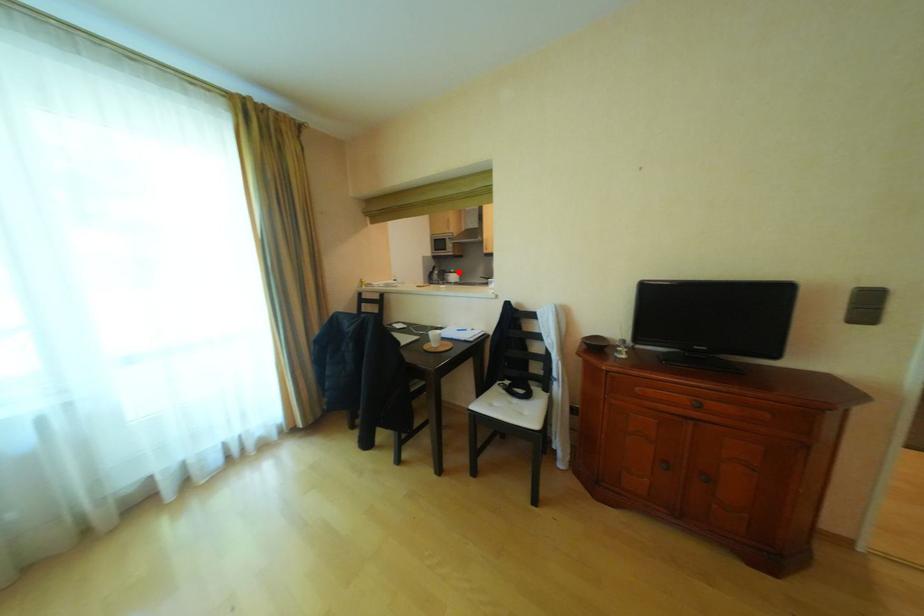
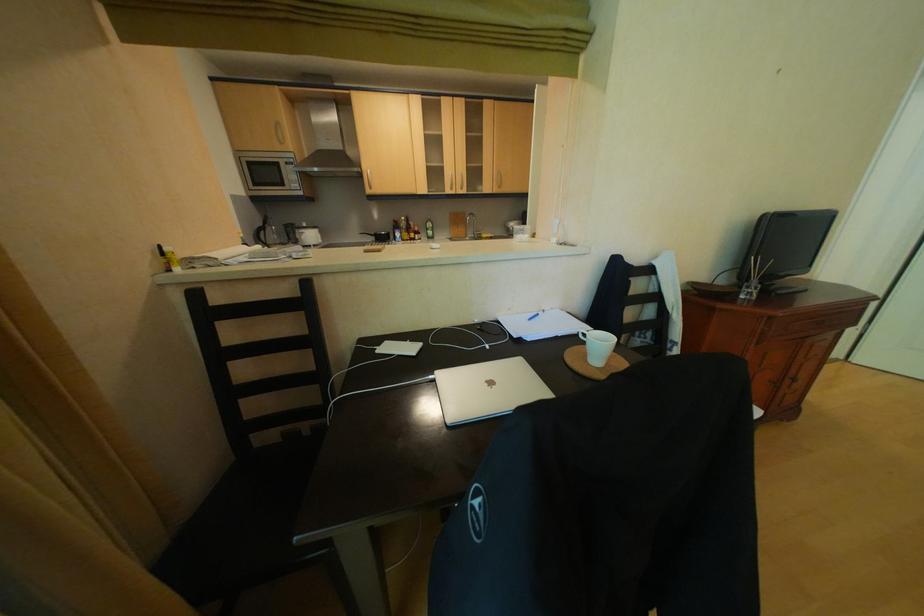
Where in the second image is the point corresponding to the highlighted location from the first image?

(309, 227)